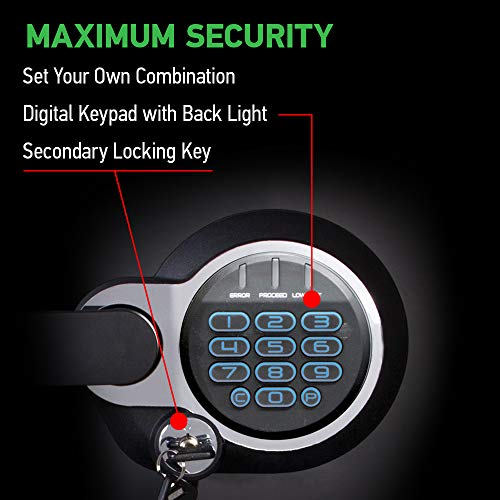
At what (x,y) coordinates should I click in order to perform the action: click on keypad. Please return your answer as a coordinate pair (x, y). Looking at the image, I should click on (111, 118).